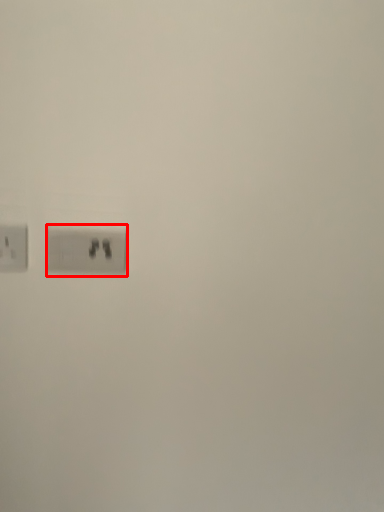
Question: From the image's perspective, what is the correct spatial positioning of power plugs and sockets (annotated by the red box) in reference to power plugs and sockets?

Choices:
 (A) above
 (B) below

Answer: (B)